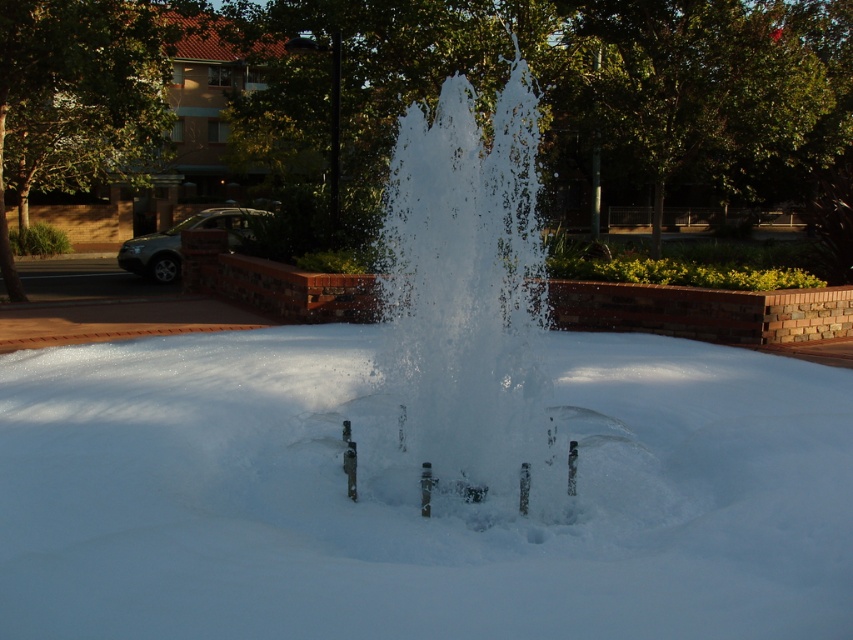
Is the position of white frosty snow at center less distant than that of clear water fountain at center?

Yes, white frosty snow at center is in front of clear water fountain at center.

What do you see at coordinates (416, 497) in the screenshot? I see `white frosty snow at center` at bounding box center [416, 497].

Image resolution: width=853 pixels, height=640 pixels. I want to click on white frosty snow at center, so click(416, 497).